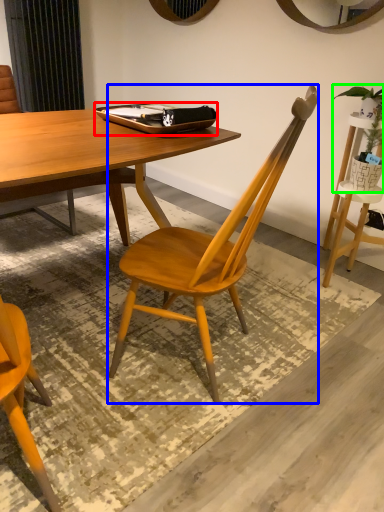
Question: Based on their relative distances, which object is nearer to tray (highlighted by a red box)? Choose from chair (highlighted by a blue box) and houseplant (highlighted by a green box).

Choices:
 (A) chair
 (B) houseplant

Answer: (A)